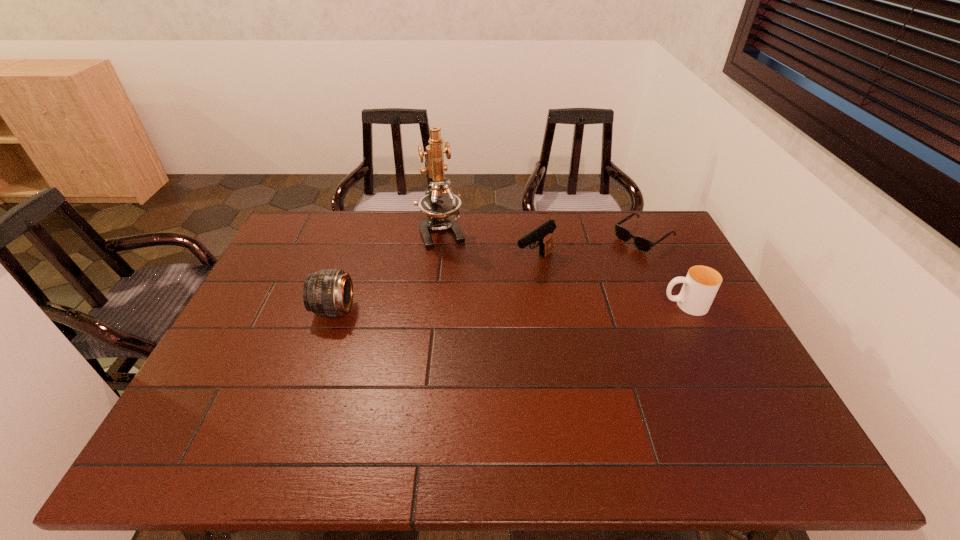
Find the location of a particular element. The image size is (960, 540). unoccupied area between the second object from left to right and the telephoto lens is located at coordinates (388, 271).

Locate which object ranks in proximity to the cup. Please provide its 2D coordinates. Your answer should be formatted as a tuple, i.e. [(x, y)], where the tuple contains the x and y coordinates of a point satisfying the conditions above.

[(642, 244)]

This screenshot has height=540, width=960. In order to click on object that is the fourth closest to the second shortest object in this screenshot , I will do `click(329, 292)`.

Locate an element on the screen. This screenshot has height=540, width=960. free space that satisfies the following two spatial constraints: 1. on the front side of the shortest object; 2. on the right side of the second object from left to right is located at coordinates (442, 237).

The image size is (960, 540). I want to click on free location that satisfies the following two spatial constraints: 1. on the front side of the tallest object; 2. with the handle on the side of the second shortest object, so click(x=434, y=305).

Locate an element on the screen. blank space that satisfies the following two spatial constraints: 1. on the back side of the third object from right to left; 2. on the right side of the sunglasses is located at coordinates (531, 237).